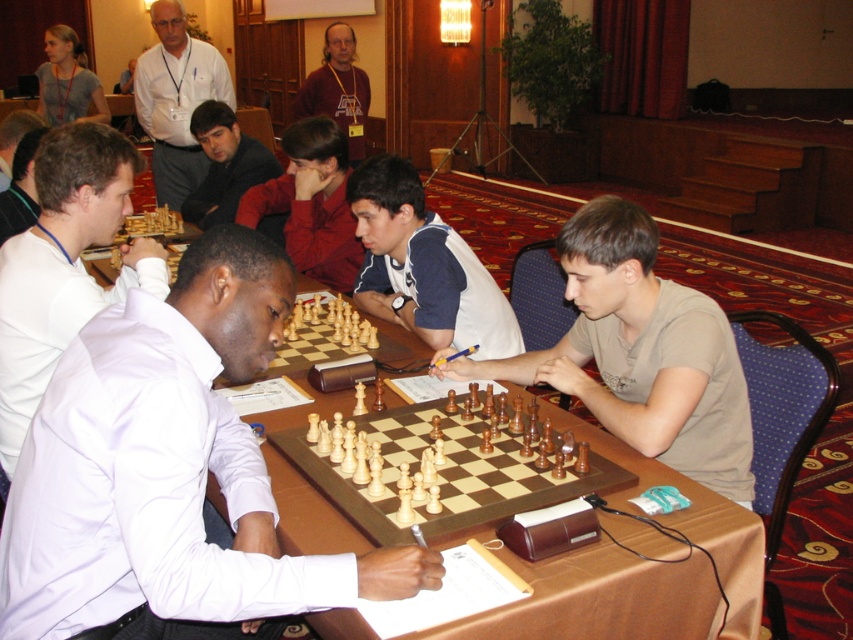
You are a photographer taking a picture of the dark brown hair at center and the gray fabric shirt at upper left. Which object should you focus on first to ensure both are in frame?

The gray fabric shirt at upper left should be focused on first because it is positioned above the dark brown hair at center, so adjusting focus starting from the upper left ensures both are in frame.

You are a photographer taking a picture of the chess tournament scene. You need to ensure that both the dark brown hair at center and the gray fabric shirt at upper left are clearly visible in the frame. Based on their positions, which object should you focus on first to ensure both are in focus?

The dark brown hair at center is shorter than the gray fabric shirt at upper left. To ensure both are in focus, you should focus on the gray fabric shirt at upper left first since it is farther away, allowing the dark brown hair at center to remain in focus as well due to its closer proximity.